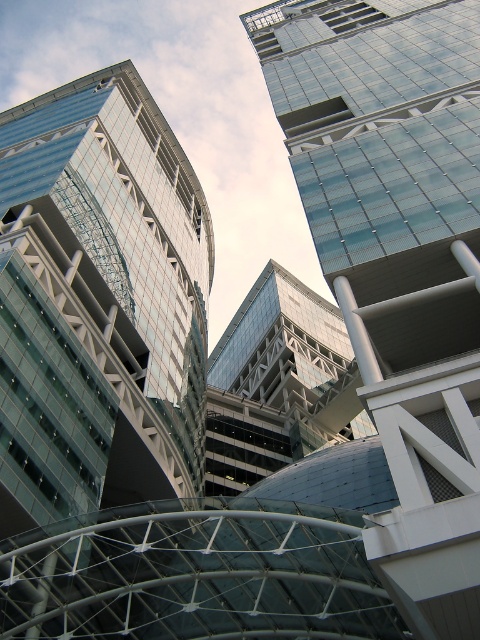
You are standing in the modern architectural scene looking up at the buildings. There are two points marked on the glass panels of the buildings. The first point is at coordinates point [397,596] and the second at point [257,300]. Which point do you think is closer to your viewpoint?

Point [397,596] is closer to the camera than point [257,300].

You are standing at the base of these buildings and want to take a photo of both the transparent glass building at upper left and the glassy steel building at center. Which building should you focus on first to ensure both are in frame?

You should focus on the transparent glass building at upper left first because it is closer to you than the glassy steel building at center, so adjusting the camera to include it will also capture the farther building in the background.

Consider the image. You are an architect analyzing the building structures in this scene. Which of the two transparent glass structures, the transparent glass skyscraper at upper center or the transparent glass building at upper left, has a narrower width?

The transparent glass skyscraper at upper center is thinner than the transparent glass building at upper left, so it has a narrower width.